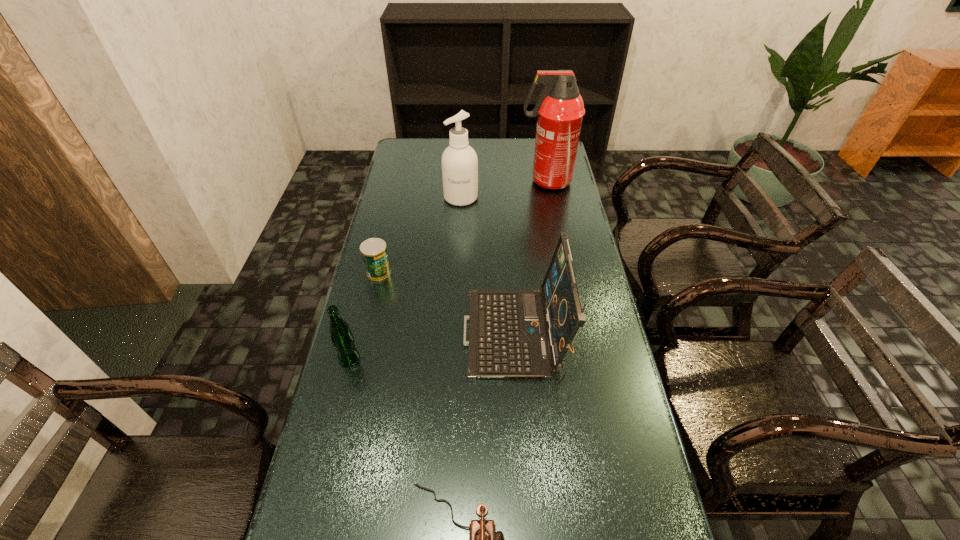
Locate an element on the screen. Image resolution: width=960 pixels, height=540 pixels. vacant space located 0.210m on the front-facing side of the fourth shortest object is located at coordinates pos(391,337).

You are a GUI agent. You are given a task and a screenshot of the screen. Output one action in this format:
    pyautogui.click(x=<x>, y=<y>)
    Task: Click on the vacant space located 0.100m on the front-facing side of the fourth shortest object
    This screenshot has height=540, width=960.
    Given the screenshot: What is the action you would take?
    click(x=429, y=337)

The image size is (960, 540). In order to click on blank space located 0.160m on the front-facing side of the fourth shortest object in this screenshot , I will do `click(408, 337)`.

At what (x,y) coordinates should I click in order to perform the action: click on vacant space located on the right of the third shortest object. Please return your answer as a coordinate pair (x, y). Looking at the image, I should click on (437, 359).

This screenshot has height=540, width=960. I want to click on vacant space located 0.310m on the back of the can, so pos(394,208).

Where is `beer bottle that is at the left edge`? beer bottle that is at the left edge is located at coordinates (342, 338).

This screenshot has width=960, height=540. I want to click on can that is at the left edge, so click(374, 253).

The image size is (960, 540). Find the location of `fire extinguisher present at the right edge`. fire extinguisher present at the right edge is located at coordinates (559, 110).

At what (x,y) coordinates should I click in order to perform the action: click on laptop computer that is at the right edge. Please return your answer as a coordinate pair (x, y). The width and height of the screenshot is (960, 540). Looking at the image, I should click on 512,334.

This screenshot has height=540, width=960. I want to click on vacant area at the far edge, so click(472, 143).